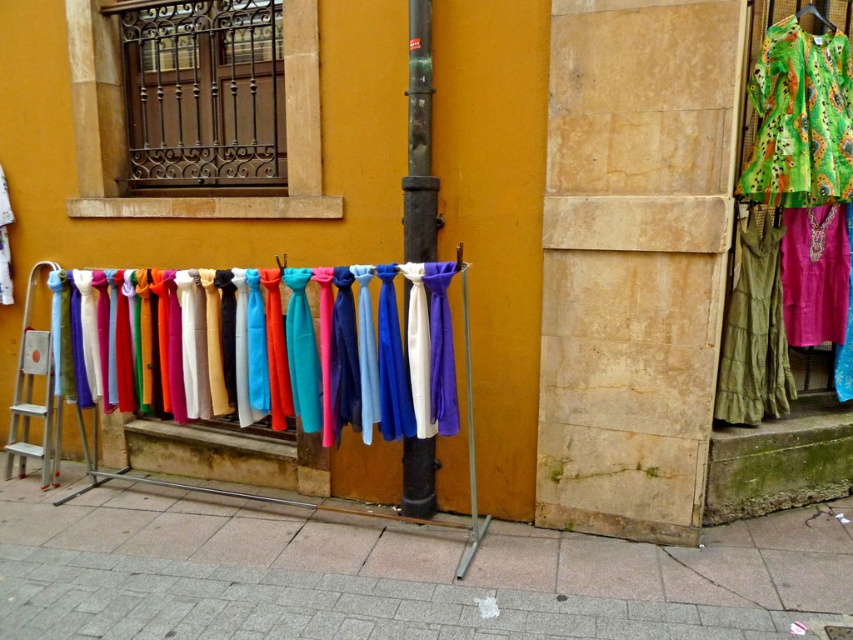
Question: Which object is closer to the camera taking this photo?

Choices:
 (A) satin scarves at center
 (B) green textured dress at right

Answer: (A)

Question: Estimate the real-world distances between objects in this image. Which object is farther from the metallic pole at center?

Choices:
 (A) smooth concrete pavement at lower center
 (B) satin scarves at center

Answer: (A)

Question: Can you confirm if smooth concrete pavement at lower center is positioned to the left of green paisley fabric dress at upper right?

Choices:
 (A) no
 (B) yes

Answer: (B)

Question: Which point appears farthest from the camera in this image?

Choices:
 (A) (776, 289)
 (B) (779, 632)

Answer: (A)

Question: Can you confirm if green paisley fabric dress at upper right is positioned to the left of green textured dress at right?

Choices:
 (A) no
 (B) yes

Answer: (A)

Question: Can you confirm if satin scarves at center is smaller than metallic pole at center?

Choices:
 (A) yes
 (B) no

Answer: (B)